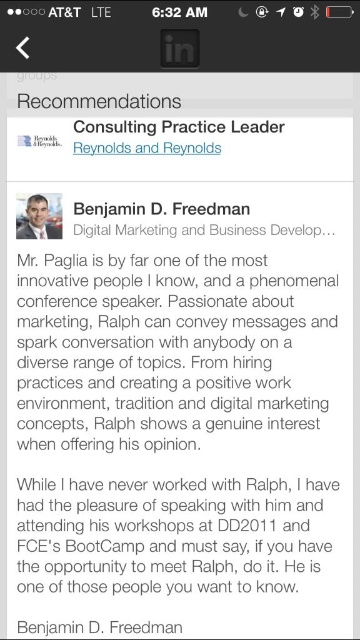
Question: Among these objects, which one is nearest to the camera?

Choices:
 (A) light brown hair at upper left
 (B) black paper text at upper center

Answer: (B)

Question: Can you confirm if black paper text at upper center is positioned above light brown hair at upper left?

Choices:
 (A) no
 (B) yes

Answer: (A)

Question: Does black paper text at upper center have a greater width compared to light brown hair at upper left?

Choices:
 (A) no
 (B) yes

Answer: (B)

Question: Does black paper text at upper center lie in front of light brown hair at upper left?

Choices:
 (A) yes
 (B) no

Answer: (A)

Question: Which object is farther from the camera taking this photo?

Choices:
 (A) light brown hair at upper left
 (B) black paper text at upper center

Answer: (A)